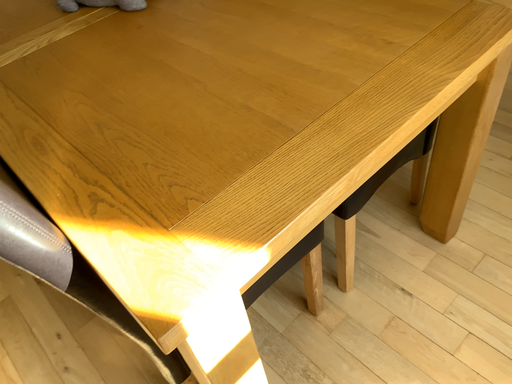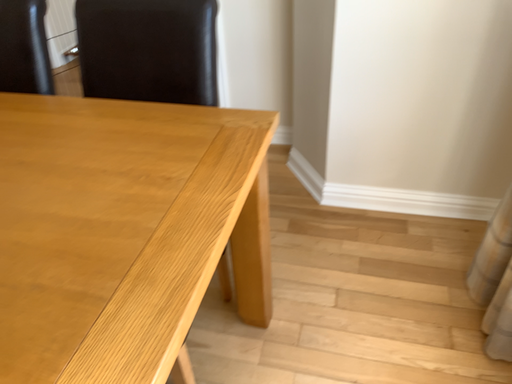
Question: Which way did the camera rotate in the video?

Choices:
 (A) rotated upward
 (B) rotated downward

Answer: (A)